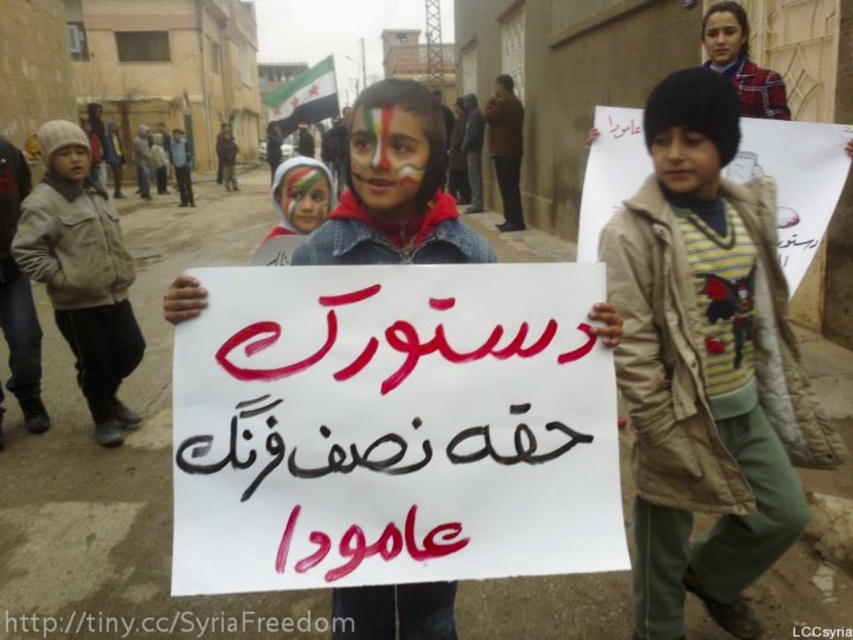
Question: Can you confirm if multicolored painted face at center is positioned to the right of painted face at center?

Choices:
 (A) no
 (B) yes

Answer: (B)

Question: Can you confirm if painted face at center is positioned below smooth skin face at upper right?

Choices:
 (A) yes
 (B) no

Answer: (A)

Question: Does matte brown hat at upper center appear on the left side of smooth skin face at upper right?

Choices:
 (A) no
 (B) yes

Answer: (B)

Question: Estimate the real-world distances between objects in this image. Which object is farther from the multicolored painted face at center?

Choices:
 (A) matte brown hat at upper center
 (B) matte beige jacket at lower left
 (C) white paper sign at center
 (D) light brown jacket at left

Answer: (B)

Question: Which object appears closest to the camera in this image?

Choices:
 (A) smooth skin face at upper right
 (B) light brown jacket at left
 (C) khaki woolen jacket at center

Answer: (C)

Question: Estimate the real-world distances between objects in this image. Which object is farther from the smooth skin face at upper right?

Choices:
 (A) multicolored painted face at center
 (B) light brown jacket at left

Answer: (B)